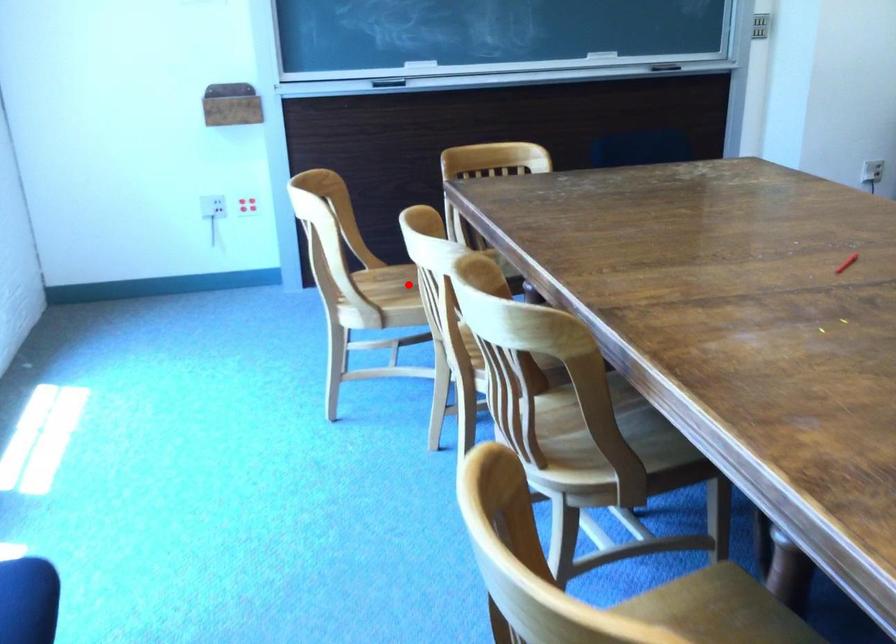
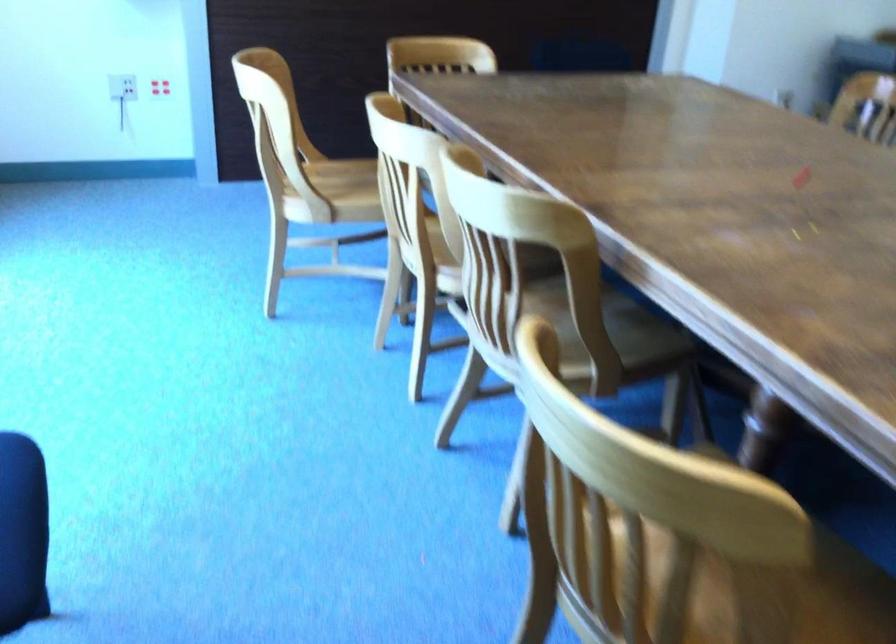
In the second image, find the point that corresponds to the highlighted location in the first image.

(347, 180)